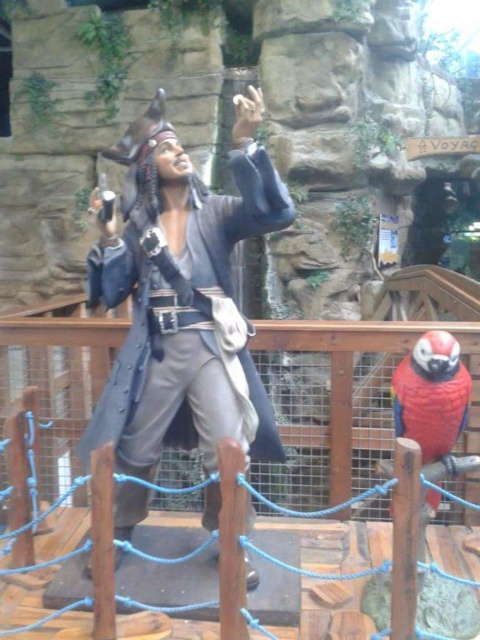
You are a treasure hunter who needs to decide which item to grab first. The matte black pirate at center and the shiny red parrot at lower right are both in your path. Based on their sizes, which one should you avoid stepping on to prevent damage?

The matte black pirate at center is bigger than the shiny red parrot at lower right, so you should avoid stepping on the shiny red parrot at lower right since it is smaller and more fragile.

You are a visitor standing at the entrance of the themed display. You want to take a photo of the matte black pirate at center without moving closer than 1.5 meters from it. Is the current distance sufficient for you to capture the entire pirate figure in your photo?

The matte black pirate at center is 1.86 meters from the viewer, which is more than the required 1.5 meters minimum distance. Therefore, the current distance is sufficient to take the photo without moving closer.